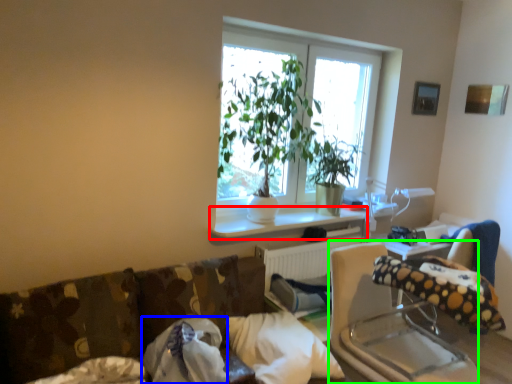
Question: Estimate the real-world distances between objects in this image. Which object is farther from window sill (highlighted by a red box), pillow (highlighted by a blue box) or rocking chair (highlighted by a green box)?

Choices:
 (A) pillow
 (B) rocking chair

Answer: (B)